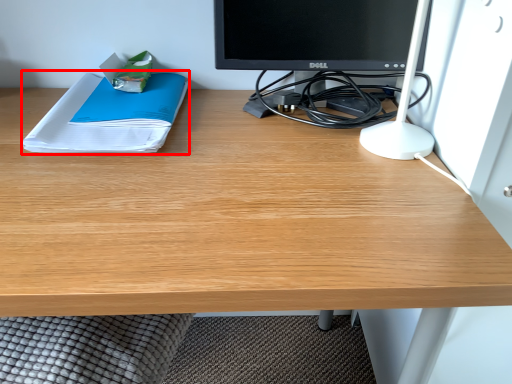
Question: From the image's perspective, considering the relative positions of paperback book (annotated by the red box) and desktop computer in the image provided, where is paperback book (annotated by the red box) located with respect to the staircase?

Choices:
 (A) above
 (B) below

Answer: (B)